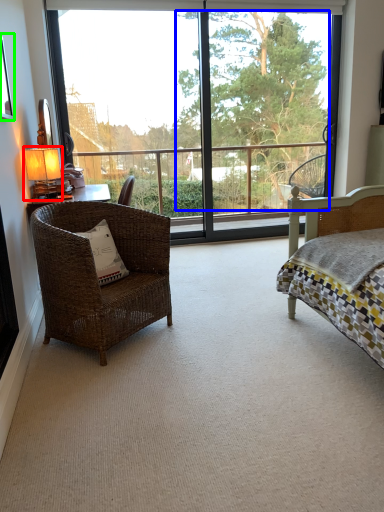
Question: Which object is positioned closest to table lamp (highlighted by a red box)? Select from tree (highlighted by a blue box) and picture frame (highlighted by a green box).

Choices:
 (A) tree
 (B) picture frame

Answer: (B)